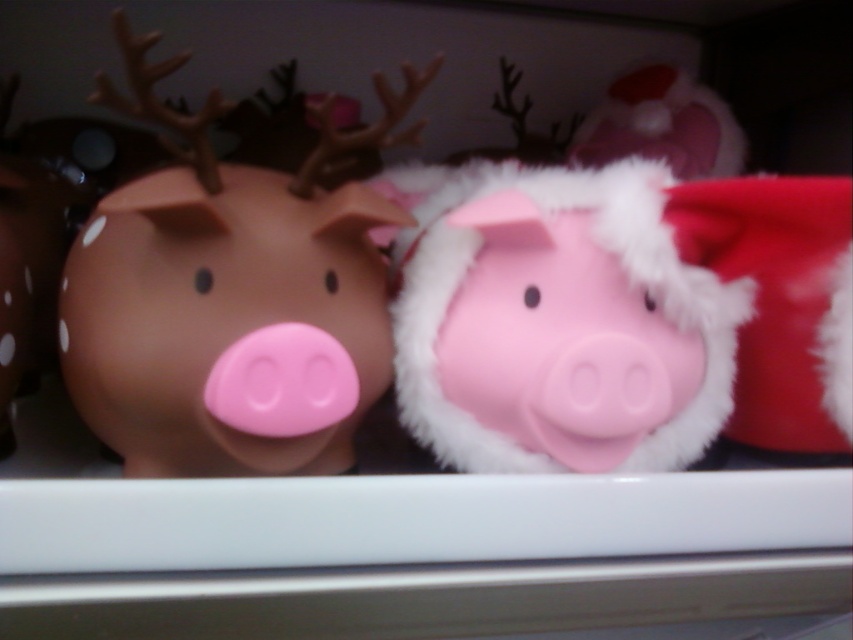
Question: Can you confirm if brown matte piggy bank at left is positioned above fuzzy pink pig at center?

Choices:
 (A) yes
 (B) no

Answer: (A)

Question: Does brown matte piggy bank at left have a smaller size compared to fuzzy pink pig at center?

Choices:
 (A) no
 (B) yes

Answer: (B)

Question: Can you confirm if brown matte piggy bank at left is positioned to the right of fuzzy pink pig at center?

Choices:
 (A) no
 (B) yes

Answer: (A)

Question: Among these points, which one is nearest to the camera?

Choices:
 (A) pyautogui.click(x=705, y=342)
 (B) pyautogui.click(x=155, y=352)

Answer: (B)

Question: Which of the following is the closest to the observer?

Choices:
 (A) (434, 330)
 (B) (320, 449)

Answer: (B)